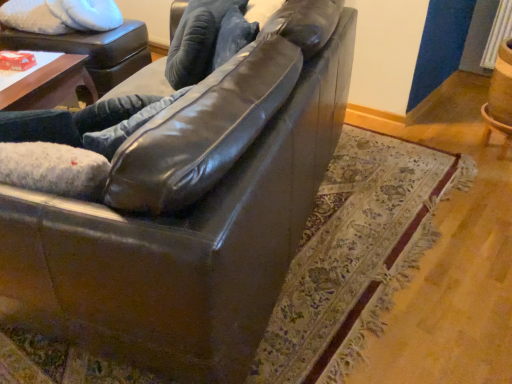
Question: Considering the relative sizes of shiny black leather couch at center and matte black swivel chair at upper left in the image provided, is shiny black leather couch at center shorter than matte black swivel chair at upper left?

Choices:
 (A) no
 (B) yes

Answer: (A)

Question: Is shiny black leather couch at center at the right side of matte black swivel chair at upper left?

Choices:
 (A) yes
 (B) no

Answer: (A)

Question: From a real-world perspective, is shiny black leather couch at center under matte black swivel chair at upper left?

Choices:
 (A) no
 (B) yes

Answer: (A)

Question: Can you confirm if shiny black leather couch at center is taller than matte black swivel chair at upper left?

Choices:
 (A) yes
 (B) no

Answer: (A)

Question: Is shiny black leather couch at center further to the viewer compared to matte black swivel chair at upper left?

Choices:
 (A) no
 (B) yes

Answer: (A)

Question: Can you confirm if shiny black leather couch at center is smaller than matte black swivel chair at upper left?

Choices:
 (A) no
 (B) yes

Answer: (B)

Question: Considering the relative positions of shiny black leather couch at center and shiny brown leather couch at center in the image provided, is shiny black leather couch at center to the left of shiny brown leather couch at center from the viewer's perspective?

Choices:
 (A) no
 (B) yes

Answer: (B)

Question: Does shiny black leather couch at center have a smaller size compared to shiny brown leather couch at center?

Choices:
 (A) yes
 (B) no

Answer: (A)

Question: Would you say shiny black leather couch at center is outside shiny brown leather couch at center?

Choices:
 (A) yes
 (B) no

Answer: (B)

Question: Is shiny brown leather couch at center completely or partially inside shiny black leather couch at center?

Choices:
 (A) yes
 (B) no

Answer: (B)

Question: Is shiny black leather couch at center touching shiny brown leather couch at center?

Choices:
 (A) no
 (B) yes

Answer: (A)

Question: Is the depth of shiny black leather couch at center less than that of shiny brown leather couch at center?

Choices:
 (A) no
 (B) yes

Answer: (A)

Question: Is shiny brown leather couch at center at the left side of shiny black leather couch at center?

Choices:
 (A) no
 (B) yes

Answer: (A)